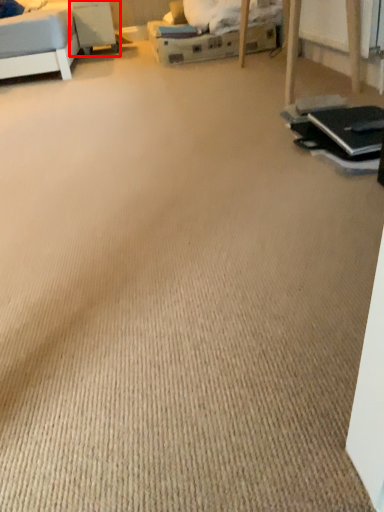
Question: Where is table (annotated by the red box) located in relation to laptop in the image?

Choices:
 (A) left
 (B) right

Answer: (A)